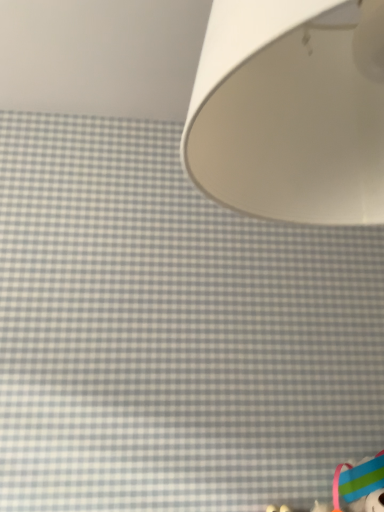
Question: Does point (336, 498) appear closer or farther from the camera than point (380, 152)?

Choices:
 (A) farther
 (B) closer

Answer: (A)

Question: Considering the positions of rubberized plastic toy at lower right and white matte lampshade at upper right in the image, is rubberized plastic toy at lower right bigger or smaller than white matte lampshade at upper right?

Choices:
 (A) small
 (B) big

Answer: (A)

Question: Choose the correct answer: Is rubberized plastic toy at lower right inside white matte lampshade at upper right or outside it?

Choices:
 (A) inside
 (B) outside

Answer: (B)

Question: Is point (370, 39) positioned closer to the camera than point (372, 499)?

Choices:
 (A) farther
 (B) closer

Answer: (B)

Question: From a real-world perspective, is white matte lampshade at upper right physically located above or below rubberized plastic toy at lower right?

Choices:
 (A) below
 (B) above

Answer: (B)

Question: Visually, is white matte lampshade at upper right positioned to the left or to the right of rubberized plastic toy at lower right?

Choices:
 (A) left
 (B) right

Answer: (A)

Question: From the image's perspective, is white matte lampshade at upper right above or below rubberized plastic toy at lower right?

Choices:
 (A) above
 (B) below

Answer: (A)